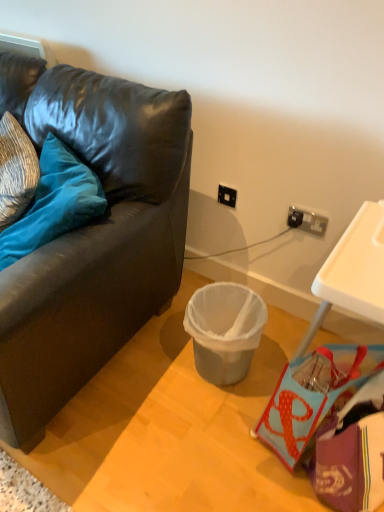
Locate an element on the screen. The width and height of the screenshot is (384, 512). vacant area to the left of purple fabric handbag at lower right is located at coordinates (239, 460).